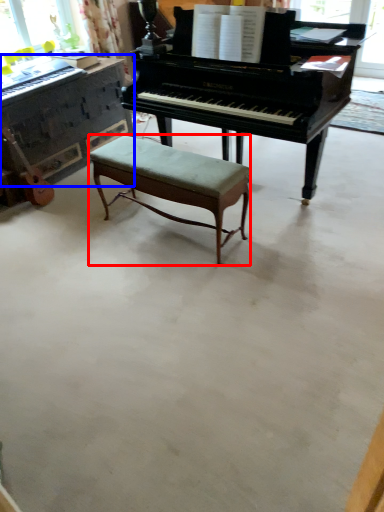
Question: Which object appears farthest to the camera in this image, stool (highlighted by a red box) or piano (highlighted by a blue box)?

Choices:
 (A) stool
 (B) piano

Answer: (B)